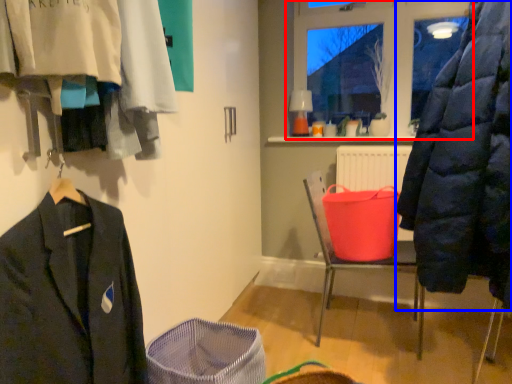
Question: Which object appears farthest to the camera in this image, window (highlighted by a red box) or coat (highlighted by a blue box)?

Choices:
 (A) window
 (B) coat

Answer: (A)